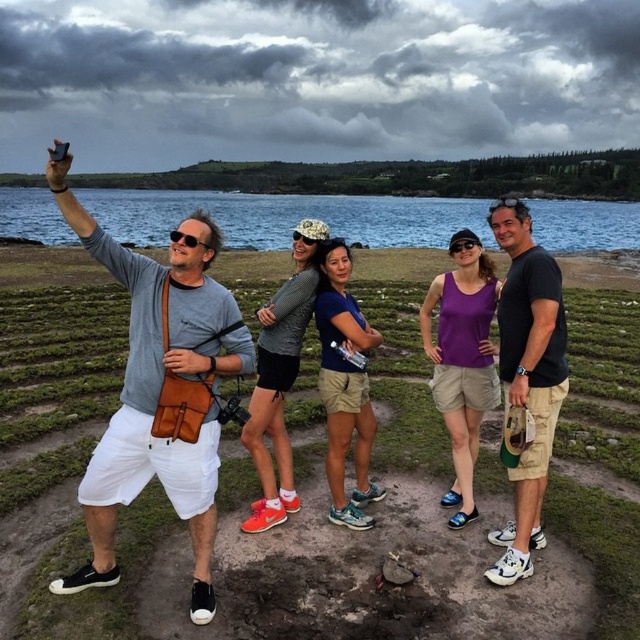
What do you see at coordinates (56, 344) in the screenshot?
I see `brown dirt field at center` at bounding box center [56, 344].

Between point (4, 275) and point (273, 429), which one is positioned behind?

Point (4, 275)

You are a GUI agent. You are given a task and a screenshot of the screen. Output one action in this format:
    pyautogui.click(x=<x>, y=<y>)
    Task: Click on the brown dirt field at center
    This screenshot has width=640, height=640.
    Given the screenshot: What is the action you would take?
    pyautogui.click(x=56, y=344)

Is blue water at upper center closer to camera compared to black cotton t-shirt at right?

No, it is behind black cotton t-shirt at right.

Consider the image. Between blue water at upper center and black cotton t-shirt at right, which one is positioned higher?

blue water at upper center

Identify the location of blue water at upper center. (288, 216).

At what (x,y) coordinates should I click in order to perform the action: click on blue water at upper center. Please return your answer as a coordinate pair (x, y). The height and width of the screenshot is (640, 640). Looking at the image, I should click on (288, 216).

In the scene shown: Can you confirm if brown dirt field at center is shorter than black cotton t-shirt at right?

In fact, brown dirt field at center may be taller than black cotton t-shirt at right.

Which is below, brown dirt field at center or black cotton t-shirt at right?

black cotton t-shirt at right

Is point (61, 339) in front of point (516, 499)?

No, it is not.

In order to click on brown dirt field at center in this screenshot , I will do `click(56, 344)`.